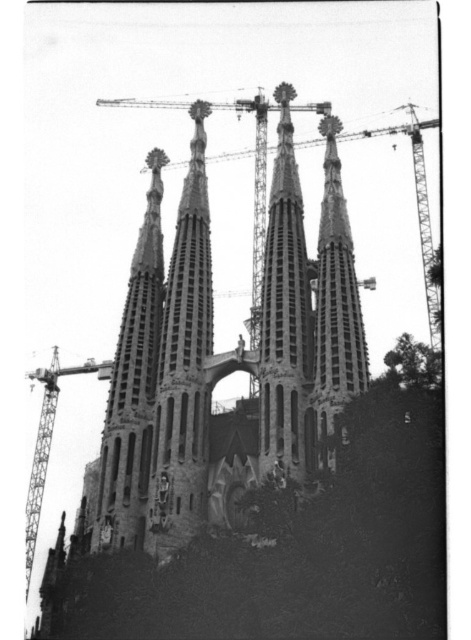
You are standing in front of the Sagrada Familia and looking at two specific points on its facade. The first point is located at coordinates point (x=265, y=355) and the second at point (x=350, y=365). Which of these points is closer to your eyes?

Point (x=265, y=355) is further to the camera than point (x=350, y=365), so the point closer to your eyes is point (x=350, y=365).

You are a photographer standing in front of the stone church at center and the rough stone spire at center. You want to capture both in a single frame. Which object should you position closer to the edge of the frame to ensure both fit within the shot?

You should position the rough stone spire at center closer to the edge of the frame because the stone church at center might be wider than the rough stone spire at center, so it requires more space in the frame.

You are standing at the base of the Sagrada Familia and want to take a photo of the point at coordinates point (257, 240). If your camera has a maximum focus range of 400 feet, will you be able to focus on that point?

The point (257, 240) is 411.84 feet away from the viewer. Since the camera can only focus up to 400 feet, it will not be able to focus on that point.